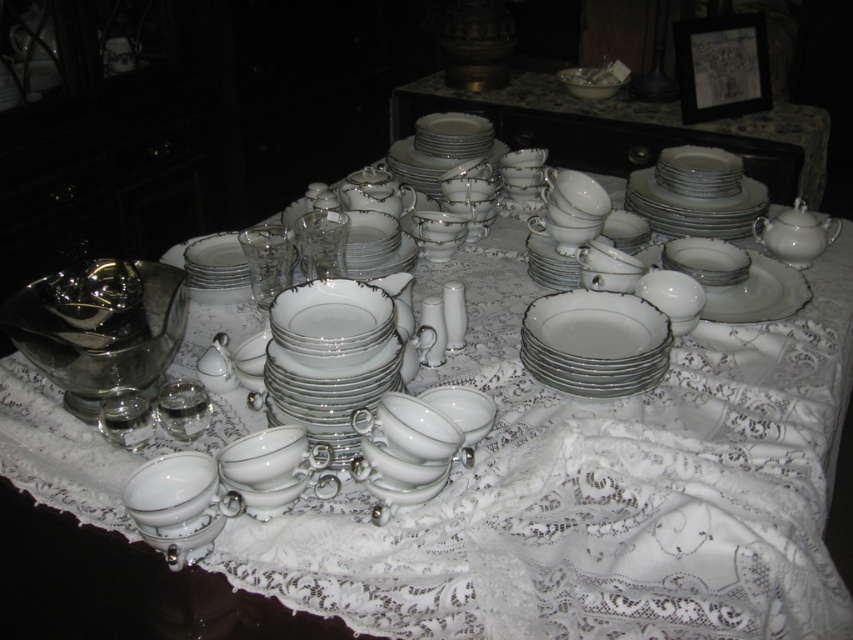
Question: Among these points, which one is farthest from the camera?

Choices:
 (A) (641, 321)
 (B) (694, 148)
 (C) (635, 106)
 (D) (335, 356)

Answer: (C)

Question: Can you confirm if white porcelain plates at upper center is smaller than white porcelain plate at center?

Choices:
 (A) no
 (B) yes

Answer: (A)

Question: Can you confirm if white porcelain plates at upper center is wider than white porcelain platter at upper right?

Choices:
 (A) no
 (B) yes

Answer: (B)

Question: Which of the following is the closest to the observer?

Choices:
 (A) (347, 428)
 (B) (599, 342)
 (C) (625, 200)

Answer: (A)

Question: Which object is farther from the camera taking this photo?

Choices:
 (A) white porcelain platter at center
 (B) white porcelain platter at upper right
 (C) white porcelain plates at upper center
 (D) white porcelain plate at center

Answer: (C)

Question: Is white porcelain plates at upper center thinner than white porcelain plate at center?

Choices:
 (A) no
 (B) yes

Answer: (A)